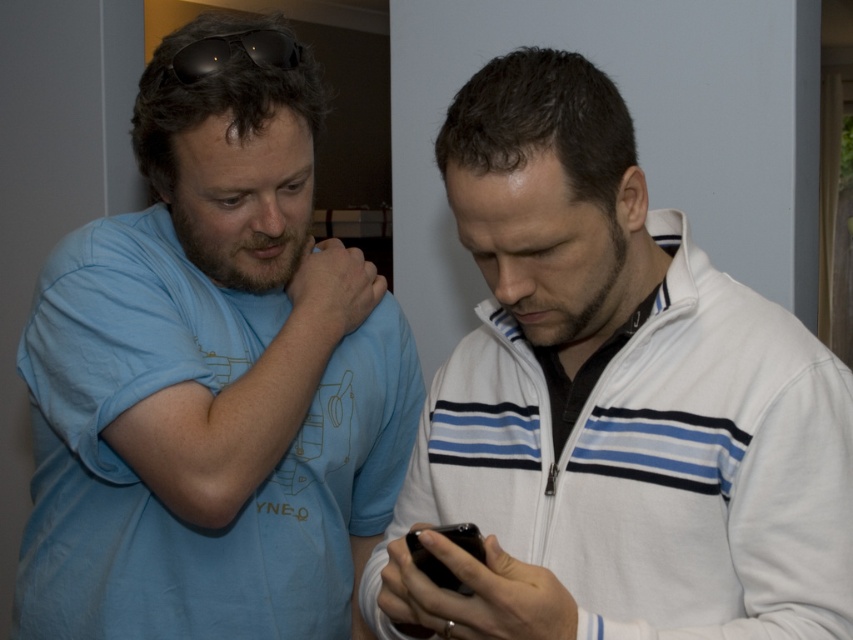
Question: Which of the following is the farthest from the observer?

Choices:
 (A) (210, 36)
 (B) (300, 419)
 (C) (670, 632)

Answer: (B)

Question: Which point is farther to the camera?

Choices:
 (A) black matte sunglasses at upper center
 (B) white fleece jacket at center

Answer: (A)

Question: Can you confirm if light blue t-shirt at left is positioned below black matte sunglasses at upper center?

Choices:
 (A) no
 (B) yes

Answer: (B)

Question: Which point appears farthest from the camera in this image?

Choices:
 (A) (210, 67)
 (B) (189, 163)
 (C) (715, 417)

Answer: (B)

Question: Is light blue t-shirt at left above black matte sunglasses at upper center?

Choices:
 (A) yes
 (B) no

Answer: (B)

Question: Is light blue t-shirt at left bigger than black matte sunglasses at upper center?

Choices:
 (A) yes
 (B) no

Answer: (A)